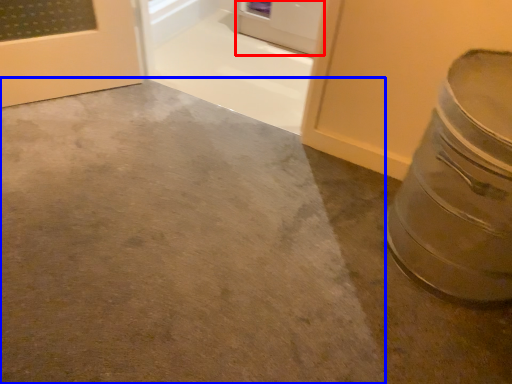
Question: Which of the following is the farthest to the observer, door (highlighted by a red box) or concrete (highlighted by a blue box)?

Choices:
 (A) door
 (B) concrete

Answer: (A)